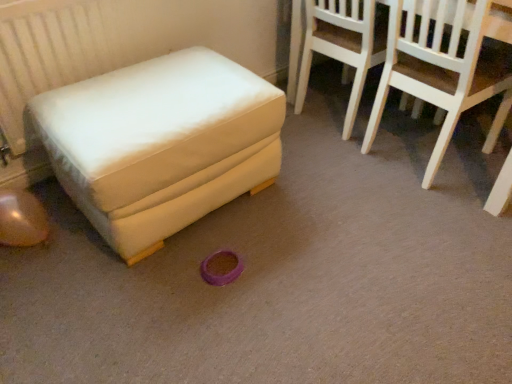
Question: In the image, is light wood chair at upper right, the 2th chair in the right-to-left sequence, on the left side or the right side of white wood chair at upper right, the second chair from the left?

Choices:
 (A) right
 (B) left

Answer: (B)

Question: From a real-world perspective, is light wood chair at upper right, positioned as the first chair in left-to-right order, above or below white wood chair at upper right, acting as the first chair starting from the right?

Choices:
 (A) below
 (B) above

Answer: (A)

Question: Estimate the real-world distances between objects in this image. Which object is closer to the white wood chair at upper right, acting as the first chair starting from the right?

Choices:
 (A) light wood chair at upper right, positioned as the first chair in left-to-right order
 (B) white fabric ottoman at left

Answer: (A)

Question: Estimate the real-world distances between objects in this image. Which object is farther from the white wood chair at upper right, the second chair from the left?

Choices:
 (A) white fabric ottoman at left
 (B) light wood chair at upper right, positioned as the first chair in left-to-right order

Answer: (A)